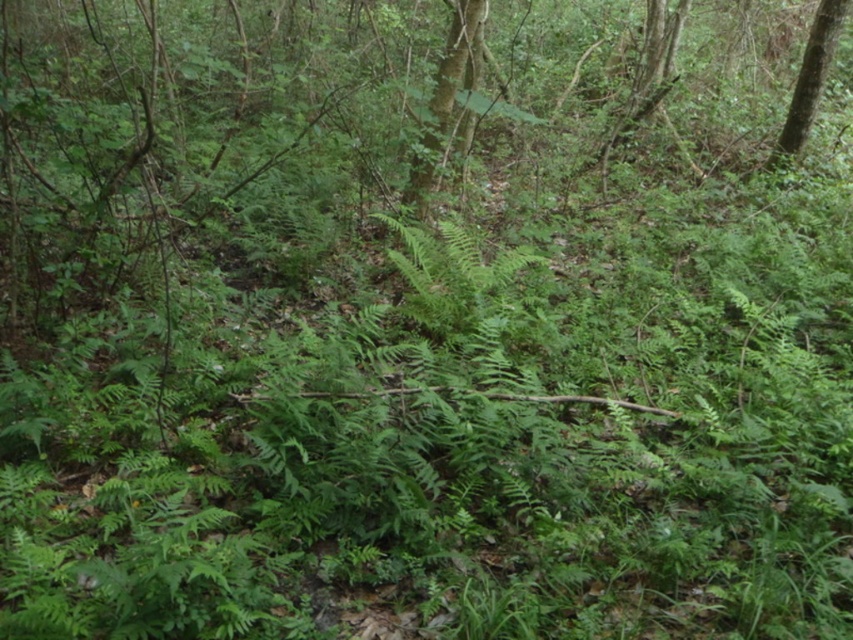
Question: Is green leafy tree at upper center smaller than green leafy tree at upper right?

Choices:
 (A) no
 (B) yes

Answer: (A)

Question: Is green leafy tree at upper center to the right of green leafy tree at upper right from the viewer's perspective?

Choices:
 (A) no
 (B) yes

Answer: (A)

Question: Is green leafy tree at upper center bigger than green leafy tree at upper right?

Choices:
 (A) yes
 (B) no

Answer: (A)

Question: Which object appears closest to the camera in this image?

Choices:
 (A) green leafy tree at upper center
 (B) green leafy tree at upper right

Answer: (A)

Question: Which object appears closest to the camera in this image?

Choices:
 (A) green leafy tree at upper right
 (B) green leafy tree at upper center

Answer: (B)